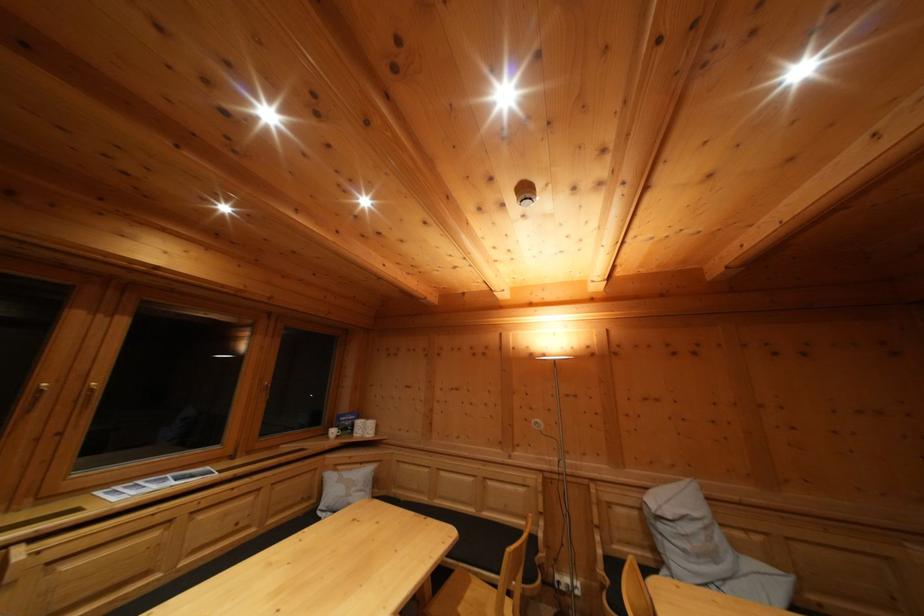
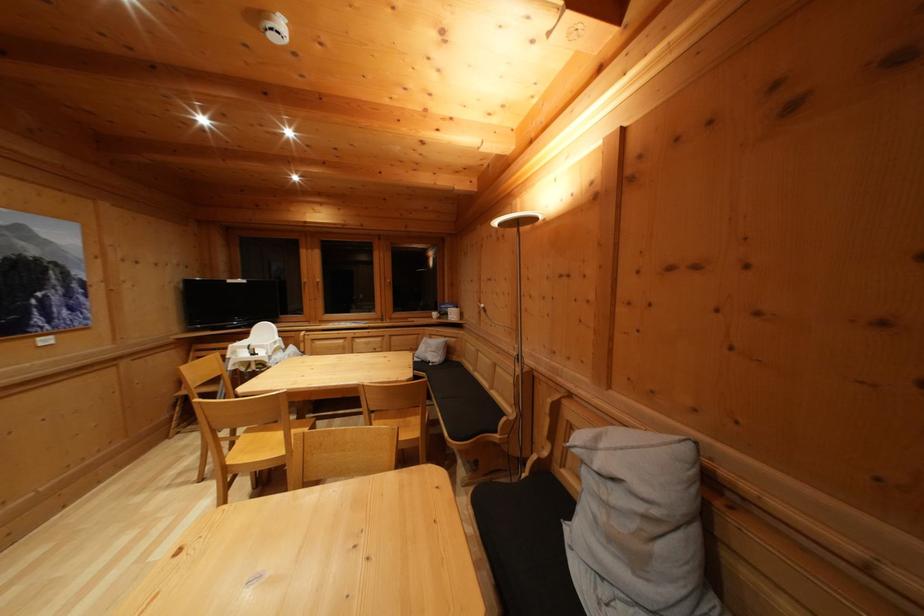
Where in the second image is the point corresponding to (x=718, y=562) from the first image?

(640, 565)